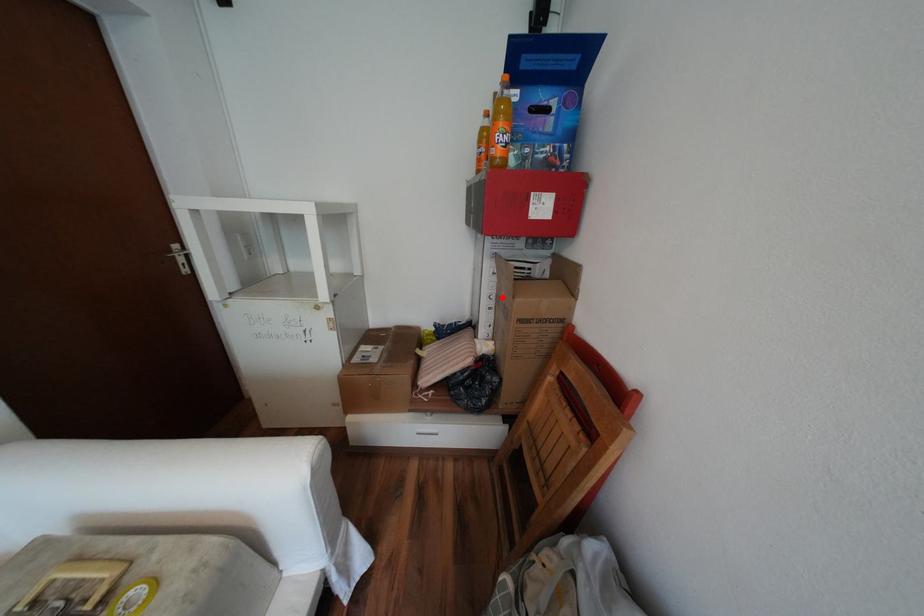
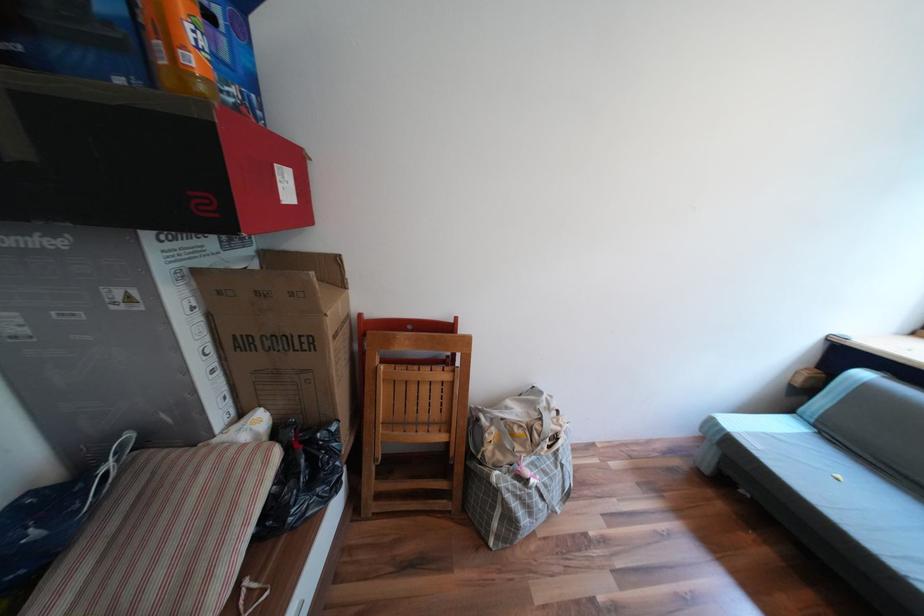
Locate, in the second image, the point that corresponds to the highlighted location in the first image.

(219, 349)